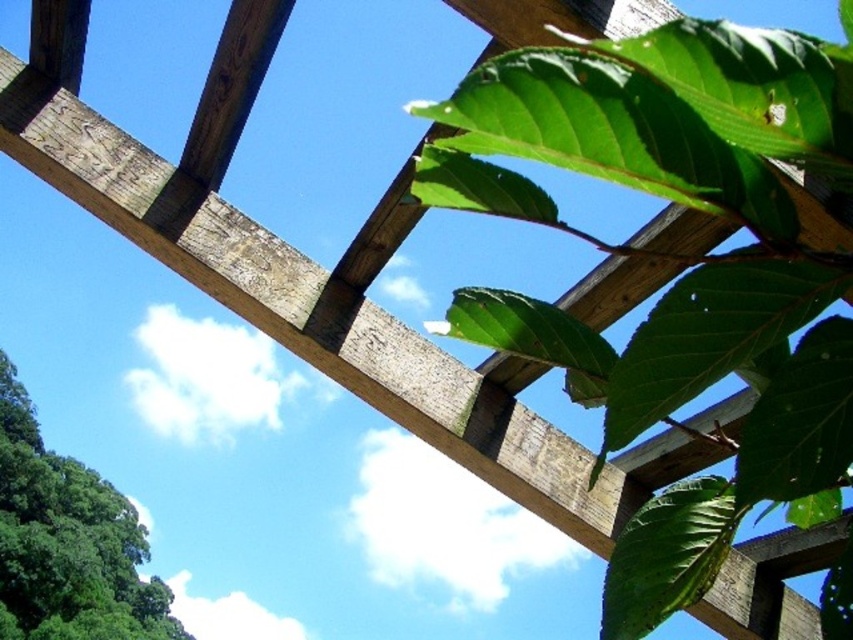
Question: Which object is closer to the camera taking this photo?

Choices:
 (A) green leafy tree at lower left
 (B) green matte leaves at upper right

Answer: (B)

Question: From the image, what is the correct spatial relationship of green matte leaves at upper right in relation to green leafy tree at lower left?

Choices:
 (A) above
 (B) below

Answer: (A)

Question: Observing the image, what is the correct spatial positioning of green matte leaves at upper right in reference to green leafy tree at lower left?

Choices:
 (A) above
 (B) below

Answer: (A)

Question: Does green matte leaves at upper right appear on the right side of green leafy tree at lower left?

Choices:
 (A) yes
 (B) no

Answer: (A)

Question: Which object is closer to the camera taking this photo?

Choices:
 (A) green leafy tree at lower left
 (B) green matte leaves at upper right

Answer: (B)